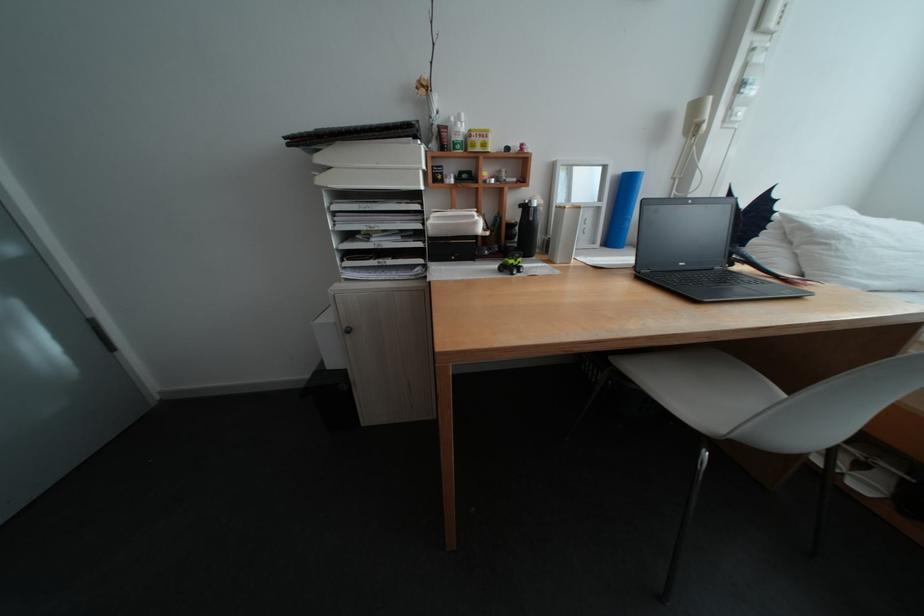
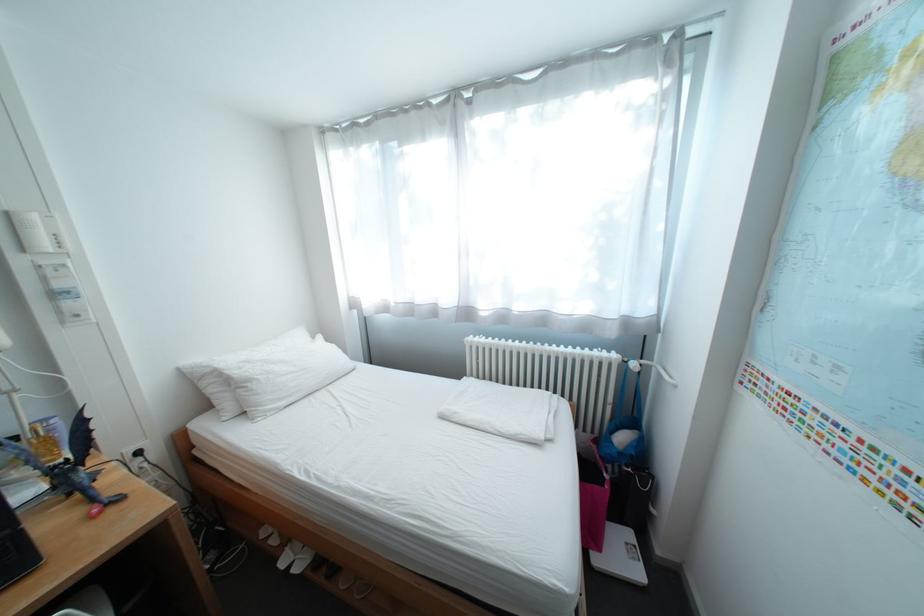
Locate, in the second image, the point that corresponds to the point at 849,240 in the first image.

(263, 383)